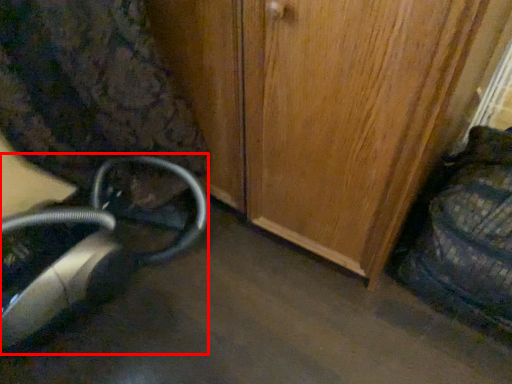
Question: Where is equipment (annotated by the red box) located in relation to swivel chair in the image?

Choices:
 (A) left
 (B) right

Answer: (A)